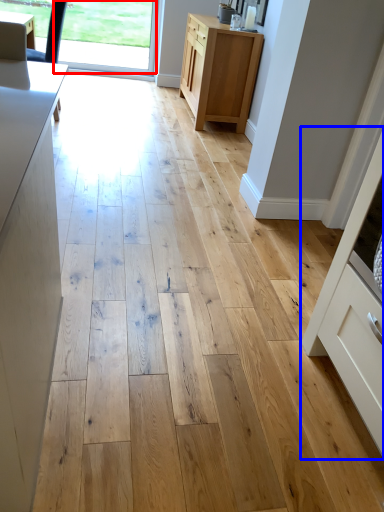
Question: Which of the following is the farthest to the observer, window screen (highlighted by a red box) or cabinetry (highlighted by a blue box)?

Choices:
 (A) window screen
 (B) cabinetry

Answer: (A)